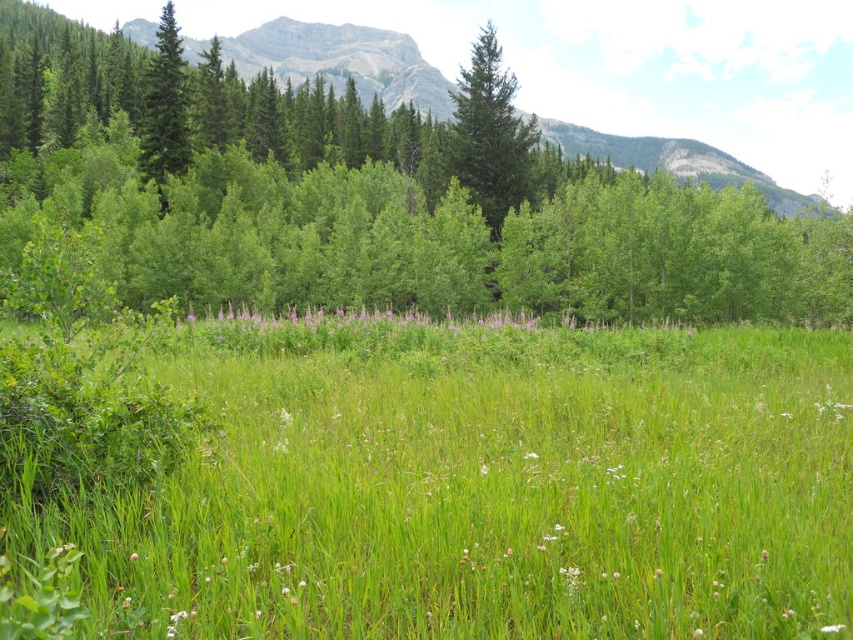
You are a gardener planning to plant a row of flowers between the green grassy pasture at center and the green matte tree at center. Based on their widths, which one do you think requires more space for planting?

The green grassy pasture at center might be wider than the green matte tree at center, so it would require more space for planting.

You are standing at the edge of the green grassy pasture at center and want to walk to the green matte evergreen tree at left. Which direction should you face to walk directly towards it?

Since the green matte evergreen tree at left is positioned to the left of the green grassy pasture at center, you should face towards the left direction to walk directly towards it.

You are standing in the meadow and want to take a photo of the green grassy pasture at center and the green matte evergreen tree at left. If you face the tree, which direction should you move to get both in the frame?

Since the green grassy pasture at center is positioned on the right side of the green matte evergreen tree at left, you should move to the right to include both the tree and the pasture in your photo.